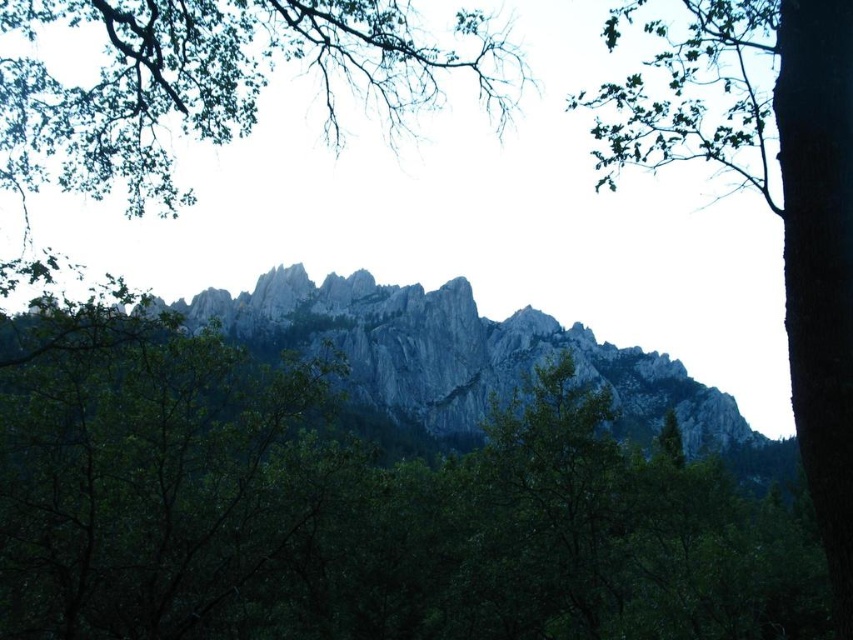
Is point (795, 234) behind point (285, 336)?

That is False.

Who is taller, green leafy tree at upper right or rugged stone mountain at center?

green leafy tree at upper right

Is point (752, 45) positioned after point (703, 400)?

No.

Locate an element on the screen. green leafy tree at upper right is located at coordinates click(x=775, y=204).

Can you confirm if green leafy tree at upper center is bigger than rugged stone mountain at center?

Yes, green leafy tree at upper center is bigger than rugged stone mountain at center.

Measure the distance from green leafy tree at upper center to rugged stone mountain at center.

green leafy tree at upper center and rugged stone mountain at center are 44.60 meters apart from each other.

I want to click on green leafy tree at upper center, so click(216, 83).

Does green leafy tree at upper center have a lesser height compared to green leafy tree at upper right?

Yes.

Who is shorter, green leafy tree at upper center or green leafy tree at upper right?

green leafy tree at upper center is shorter.

I want to click on green leafy tree at upper center, so click(x=216, y=83).